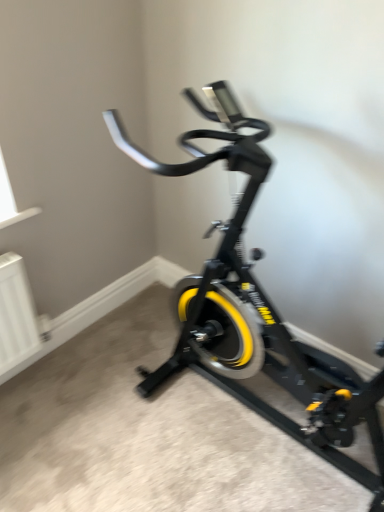
The image size is (384, 512). What do you see at coordinates (256, 311) in the screenshot? I see `yellow matte stationary bicycle at center` at bounding box center [256, 311].

Identify the location of yellow matte stationary bicycle at center. The width and height of the screenshot is (384, 512). (256, 311).

Locate an element on the screen. The height and width of the screenshot is (512, 384). yellow matte stationary bicycle at center is located at coordinates 256,311.